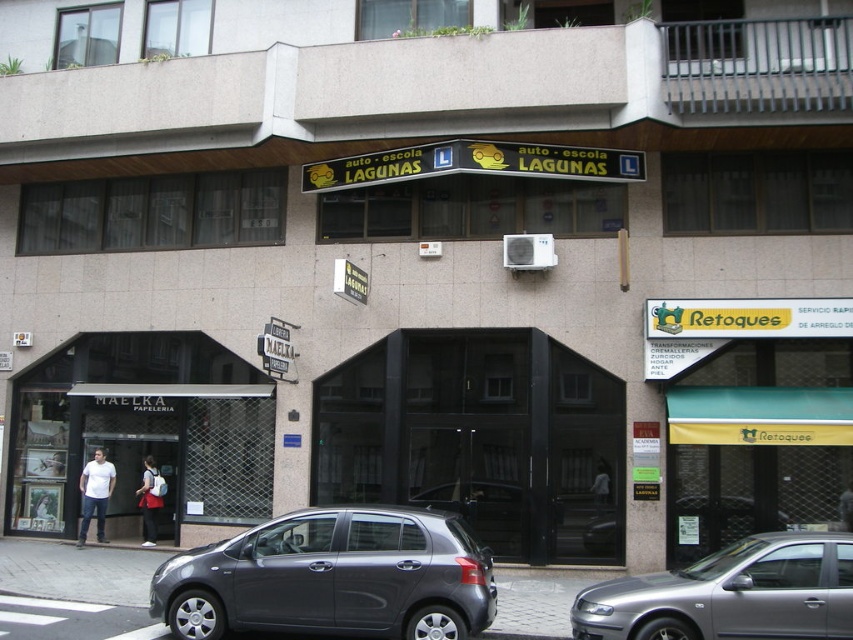
Between black glass door at center and satin metallic hatchback at center, which one is positioned higher?

black glass door at center is higher up.

The image size is (853, 640). Describe the element at coordinates (479, 438) in the screenshot. I see `black glass door at center` at that location.

The width and height of the screenshot is (853, 640). Find the location of `black glass door at center`. black glass door at center is located at coordinates (479, 438).

Identify the location of black glass door at center. The height and width of the screenshot is (640, 853). (479, 438).

Which is more to the left, white backpack at center or white fabric bag at center?

white backpack at center is more to the left.

Is white backpack at center taller than white fabric bag at center?

Yes, white backpack at center is taller than white fabric bag at center.

Is point (144, 476) behind point (608, 497)?

Yes, it is behind point (608, 497).

I want to click on white backpack at center, so click(x=149, y=499).

What do you see at coordinates (479, 438) in the screenshot? I see `black glass door at center` at bounding box center [479, 438].

Between point (316, 444) and point (598, 492), which one is positioned in front?

Point (598, 492)

You are a GUI agent. You are given a task and a screenshot of the screen. Output one action in this format:
    pyautogui.click(x=<x>, y=<y>)
    Task: Click on the black glass door at center
    
    Given the screenshot: What is the action you would take?
    pyautogui.click(x=479, y=438)